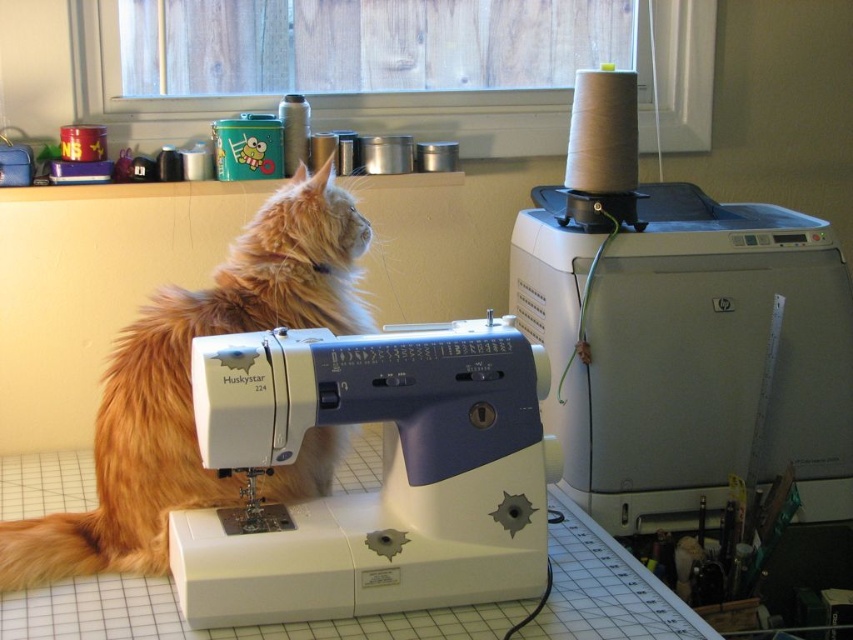
Question: Which of the following is the closest to the observer?

Choices:
 (A) white plastic sewing machine at center
 (B) fluffy orange cat at left

Answer: (A)

Question: Does white plastic sewing machine at upper right lie in front of fluffy orange cat at left?

Choices:
 (A) yes
 (B) no

Answer: (B)

Question: Can you confirm if white plastic sewing machine at upper right is wider than white plastic sewing machine at center?

Choices:
 (A) no
 (B) yes

Answer: (B)

Question: Is white plastic sewing machine at center to the right of fluffy orange cat at left from the viewer's perspective?

Choices:
 (A) yes
 (B) no

Answer: (A)

Question: Which object is the farthest from the fluffy orange cat at left?

Choices:
 (A) white plastic sewing machine at upper right
 (B) white plastic sewing machine at center

Answer: (A)

Question: Among these objects, which one is farthest from the camera?

Choices:
 (A) white plastic sewing machine at upper right
 (B) white plastic sewing machine at center

Answer: (A)